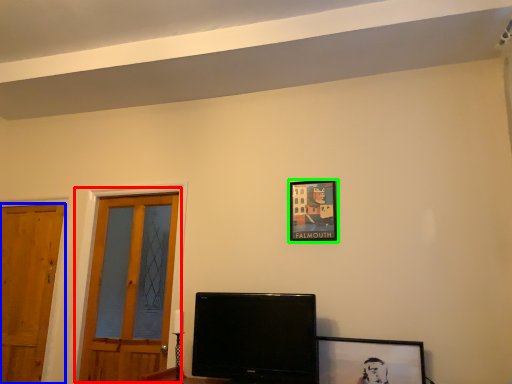
Question: Estimate the real-world distances between objects in this image. Which object is farther from door (highlighted by a red box), door (highlighted by a blue box) or picture frame (highlighted by a green box)?

Choices:
 (A) door
 (B) picture frame

Answer: (B)